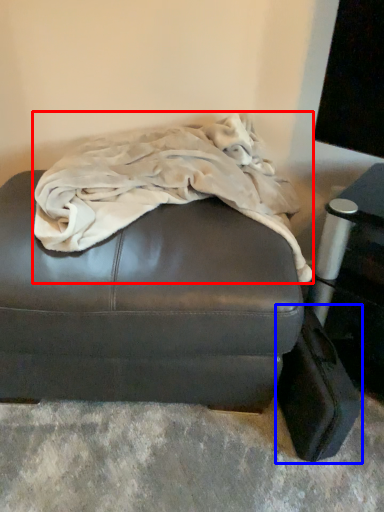
Question: Among these objects, which one is farthest to the camera, blanket (highlighted by a red box) or luggage (highlighted by a blue box)?

Choices:
 (A) blanket
 (B) luggage

Answer: (B)